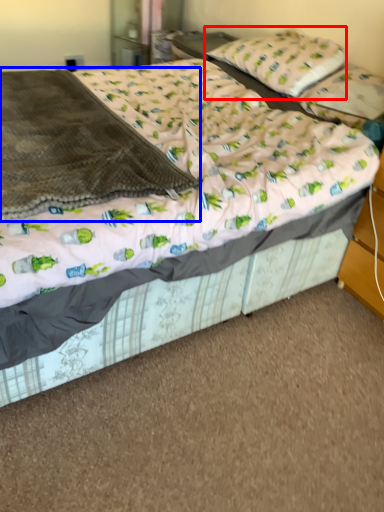
Question: Which point is closer to the camera, pillow (highlighted by a red box) or blanket (highlighted by a blue box)?

Choices:
 (A) pillow
 (B) blanket

Answer: (B)